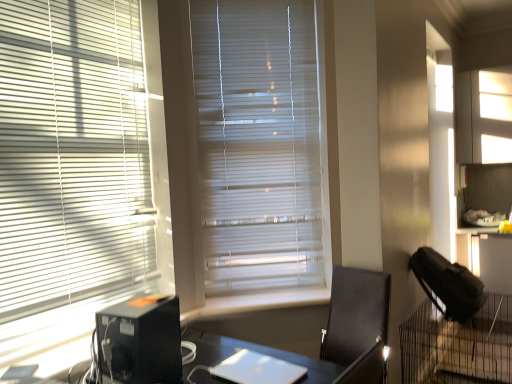
What do you see at coordinates (258, 144) in the screenshot? I see `white matte blinds at center, which is the second window blind from left to right` at bounding box center [258, 144].

This screenshot has width=512, height=384. Find the location of `black plastic computer tower at lower left`. black plastic computer tower at lower left is located at coordinates (140, 342).

Identify the location of white matte blinds at left, marked as the 2th window blind in a right-to-left arrangement. (71, 153).

Where is `black leather chair at center`? black leather chair at center is located at coordinates (358, 324).

Is white matte blinds at center, the second window blind positioned from the front, wider or thinner than white matte blinds at left, marked as the 2th window blind in a right-to-left arrangement?

Considering their sizes, white matte blinds at center, the second window blind positioned from the front, looks slimmer than white matte blinds at left, marked as the 2th window blind in a right-to-left arrangement.

Which is behind, white matte blinds at center, the second window blind positioned from the front, or white matte blinds at left, the 1th window blind when ordered from left to right?

white matte blinds at center, the second window blind positioned from the front.

Image resolution: width=512 pixels, height=384 pixels. Identify the location of window blind in front of the white matte blinds at center, which is the second window blind from left to right. (71, 153).

Considering the sizes of objects white matte blinds at center, which is the first window blind in back-to-front order, and white matte blinds at left, the 1th window blind when ordered from left to right, in the image provided, who is smaller, white matte blinds at center, which is the first window blind in back-to-front order, or white matte blinds at left, the 1th window blind when ordered from left to right,?

Smaller between the two is white matte blinds at center, which is the first window blind in back-to-front order.

Who is smaller, white smooth window sill at center or white matte blinds at left, acting as the 1th window blind starting from the front?

With smaller size is white smooth window sill at center.

You are a GUI agent. You are given a task and a screenshot of the screen. Output one action in this format:
    pyautogui.click(x=<x>, y=<y>)
    Task: Click on the window blind that is the 1st object located above the white smooth window sill at center (from the image's perspective)
    
    Given the screenshot: What is the action you would take?
    pyautogui.click(x=71, y=153)

From a real-world perspective, which is physically below, white smooth window sill at center or white matte blinds at left, marked as the 2th window blind in a right-to-left arrangement?

white smooth window sill at center, from a real-world perspective.

Which of these two, white smooth window sill at center or white matte blinds at left, acting as the 2th window blind starting from the back, stands taller?

Standing taller between the two is white matte blinds at left, acting as the 2th window blind starting from the back.

Which of these two, black leather chair at center or white smooth window sill at center, is wider?

black leather chair at center is wider.

Which point is more forward, (371, 341) or (206, 309)?

The point (371, 341) is closer to the camera.

Locate an element on the screen. The height and width of the screenshot is (384, 512). window sill located above the black leather chair at center (from a real-world perspective) is located at coordinates (263, 301).

Who is taller, white matte blinds at center, which ranks as the 1th window blind in right-to-left order, or black plastic computer tower at lower left?

Standing taller between the two is white matte blinds at center, which ranks as the 1th window blind in right-to-left order.

How different are the orientations of white matte blinds at center, which is the second window blind from left to right, and black plastic computer tower at lower left in degrees?

The angular difference between white matte blinds at center, which is the second window blind from left to right, and black plastic computer tower at lower left is 56.6 degrees.

Which is more to the right, white matte blinds at center, which ranks as the 1th window blind in right-to-left order, or black plastic computer tower at lower left?

white matte blinds at center, which ranks as the 1th window blind in right-to-left order, is more to the right.

Consider the image. Is white smooth window sill at center outside of black plastic computer tower at lower left?

Yes, white smooth window sill at center is outside of black plastic computer tower at lower left.

Considering their positions, is white smooth window sill at center located in front of or behind black plastic computer tower at lower left?

Visually, white smooth window sill at center is located behind black plastic computer tower at lower left.

Based on their positions, is white smooth window sill at center located to the left or right of black plastic computer tower at lower left?

In the image, white smooth window sill at center appears on the right side of black plastic computer tower at lower left.

Where is `computer tower located above the white smooth window sill at center (from the image's perspective)`? Image resolution: width=512 pixels, height=384 pixels. computer tower located above the white smooth window sill at center (from the image's perspective) is located at coordinates (x=140, y=342).

Is black leather chair at center at the left side of black plastic computer tower at lower left?

Incorrect, black leather chair at center is not on the left side of black plastic computer tower at lower left.

Is black leather chair at center shorter than black plastic computer tower at lower left?

Incorrect, the height of black leather chair at center does not fall short of that of black plastic computer tower at lower left.

Is black plastic computer tower at lower left located within black leather chair at center?

No, black plastic computer tower at lower left is not surrounded by black leather chair at center.

Looking at this image, is black leather chair at center oriented towards black plastic computer tower at lower left?

Yes, black leather chair at center is oriented towards black plastic computer tower at lower left.

Is silver metallic laptop at center situated inside black mesh cage at lower right or outside?

silver metallic laptop at center is spatially situated outside black mesh cage at lower right.

Looking at this image, does silver metallic laptop at center turn towards black mesh cage at lower right?

No, silver metallic laptop at center is not aimed at black mesh cage at lower right.

From a real-world perspective, is silver metallic laptop at center located higher than black mesh cage at lower right?

Indeed, from a real-world perspective, silver metallic laptop at center stands above black mesh cage at lower right.

The width and height of the screenshot is (512, 384). Find the location of `computer desk below the silver metallic laptop at center (from a real-world perspective)`. computer desk below the silver metallic laptop at center (from a real-world perspective) is located at coordinates (458, 345).

Identify the location of window blind on the left of white matte blinds at center, which is the first window blind in back-to-front order. (71, 153).

This screenshot has width=512, height=384. Identify the location of window sill that appears below the white matte blinds at left, marked as the 2th window blind in a right-to-left arrangement (from a real-world perspective). (263, 301).

Looking at the image, which one is located closer to white matte blinds at center, which ranks as the 1th window blind in right-to-left order, silver metallic laptop at center or black leather chair at center?

Among the two, black leather chair at center is located nearer to white matte blinds at center, which ranks as the 1th window blind in right-to-left order.

When comparing their distances from white smooth window sill at center, does white matte blinds at center, which ranks as the 1th window blind in right-to-left order, or white matte blinds at left, marked as the 2th window blind in a right-to-left arrangement, seem closer?

Among the two, white matte blinds at center, which ranks as the 1th window blind in right-to-left order, is located nearer to white smooth window sill at center.

Consider the image. Based on their spatial positions, is black plastic computer tower at lower left or silver metallic laptop at center further from white matte blinds at center, which is the first window blind in back-to-front order?

The object further to white matte blinds at center, which is the first window blind in back-to-front order, is silver metallic laptop at center.

Looking at the image, which one is located closer to white matte blinds at left, marked as the 2th window blind in a right-to-left arrangement, silver metallic laptop at center or black leather chair at center?

silver metallic laptop at center is closer to white matte blinds at left, marked as the 2th window blind in a right-to-left arrangement.

Based on their spatial positions, is black leather chair at center or white matte blinds at left, acting as the 1th window blind starting from the front, further from black mesh cage at lower right?

white matte blinds at left, acting as the 1th window blind starting from the front, lies further to black mesh cage at lower right than the other object.

Estimate the real-world distances between objects in this image. Which object is further from white smooth window sill at center, black leather chair at center or silver metallic laptop at center?

Based on the image, silver metallic laptop at center appears to be further to white smooth window sill at center.

Estimate the real-world distances between objects in this image. Which object is further from black plastic computer tower at lower left, silver metallic laptop at center or white matte blinds at left, acting as the 2th window blind starting from the back?

white matte blinds at left, acting as the 2th window blind starting from the back, lies further to black plastic computer tower at lower left than the other object.

Based on their spatial positions, is white smooth window sill at center or silver metallic laptop at center closer to black mesh cage at lower right?

white smooth window sill at center.

Where is `computer chair situated between white smooth window sill at center and black mesh cage at lower right from left to right`? Image resolution: width=512 pixels, height=384 pixels. computer chair situated between white smooth window sill at center and black mesh cage at lower right from left to right is located at coordinates (358, 324).

Locate an element on the screen. The width and height of the screenshot is (512, 384). computer chair between silver metallic laptop at center and white smooth window sill at center along the z-axis is located at coordinates (358, 324).

Where is `window sill between black plastic computer tower at lower left and black mesh cage at lower right from left to right`? window sill between black plastic computer tower at lower left and black mesh cage at lower right from left to right is located at coordinates (263, 301).

Find the location of a particular element. Image resolution: width=512 pixels, height=384 pixels. window sill between white matte blinds at center, which ranks as the 1th window blind in right-to-left order, and silver metallic laptop at center, in the vertical direction is located at coordinates (263, 301).